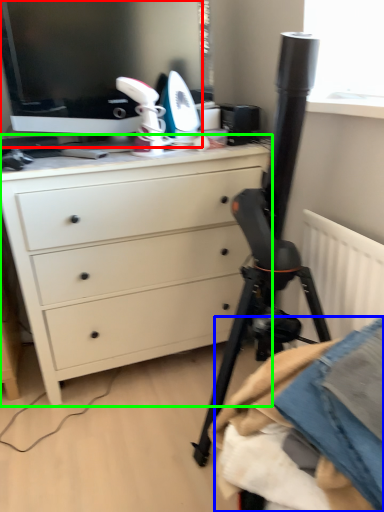
Question: Which is farther away from computer monitor (highlighted by a red box)? clothing (highlighted by a blue box) or chest of drawers (highlighted by a green box)?

Choices:
 (A) clothing
 (B) chest of drawers

Answer: (A)